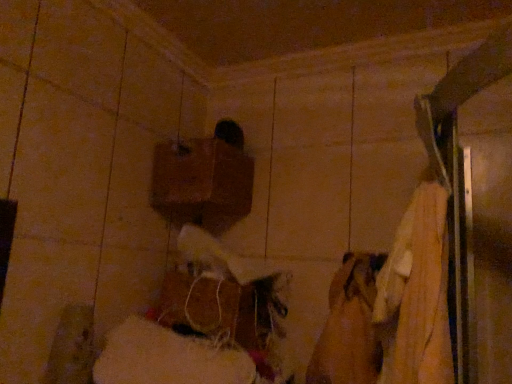
Question: From a real-world perspective, is brown matte wood at upper center, positioned as the 2th wood in bottom-to-top order, beneath woodenmaterial/texture at center, which ranks as the second wood in top-to-bottom order?

Choices:
 (A) no
 (B) yes

Answer: (A)

Question: Is brown matte wood at upper center, marked as the 1th wood in a top-to-bottom arrangement, taller than woodenmaterial/texture at center, which ranks as the second wood in top-to-bottom order?

Choices:
 (A) no
 (B) yes

Answer: (B)

Question: Could you tell me if brown matte wood at upper center, marked as the 1th wood in a top-to-bottom arrangement, is turned towards woodenmaterial/texture at center, which ranks as the second wood in top-to-bottom order?

Choices:
 (A) yes
 (B) no

Answer: (B)

Question: Is brown matte wood at upper center, positioned as the 2th wood in bottom-to-top order, next to woodenmaterial/texture at center, the first wood positioned from the bottom?

Choices:
 (A) yes
 (B) no

Answer: (B)

Question: Does brown matte wood at upper center, positioned as the 2th wood in bottom-to-top order, have a lesser width compared to woodenmaterial/texture at center, which ranks as the second wood in top-to-bottom order?

Choices:
 (A) no
 (B) yes

Answer: (A)

Question: Is brown matte wood at upper center, positioned as the 2th wood in bottom-to-top order, facing away from woodenmaterial/texture at center, the first wood positioned from the bottom?

Choices:
 (A) yes
 (B) no

Answer: (B)

Question: Does woodenmaterial/texture at center, which ranks as the second wood in top-to-bottom order, have a larger size compared to brown matte wood at upper center, marked as the 1th wood in a top-to-bottom arrangement?

Choices:
 (A) no
 (B) yes

Answer: (B)

Question: Could you tell me if woodenmaterial/texture at center, which ranks as the second wood in top-to-bottom order, is facing brown matte wood at upper center, marked as the 1th wood in a top-to-bottom arrangement?

Choices:
 (A) yes
 (B) no

Answer: (B)

Question: From a real-world perspective, is woodenmaterial/texture at center, which ranks as the second wood in top-to-bottom order, located beneath brown matte wood at upper center, positioned as the 2th wood in bottom-to-top order?

Choices:
 (A) yes
 (B) no

Answer: (A)

Question: Is woodenmaterial/texture at center, the first wood positioned from the bottom, shorter than brown matte wood at upper center, positioned as the 2th wood in bottom-to-top order?

Choices:
 (A) yes
 (B) no

Answer: (A)

Question: Is woodenmaterial/texture at center, which ranks as the second wood in top-to-bottom order, located outside brown matte wood at upper center, marked as the 1th wood in a top-to-bottom arrangement?

Choices:
 (A) no
 (B) yes

Answer: (B)

Question: Does woodenmaterial/texture at center, which ranks as the second wood in top-to-bottom order, appear on the left side of brown matte wood at upper center, positioned as the 2th wood in bottom-to-top order?

Choices:
 (A) no
 (B) yes

Answer: (A)

Question: Is brown matte wood at upper center, positioned as the 2th wood in bottom-to-top order, wider or thinner than woodenmaterial/texture at center, which ranks as the second wood in top-to-bottom order?

Choices:
 (A) wide
 (B) thin

Answer: (A)